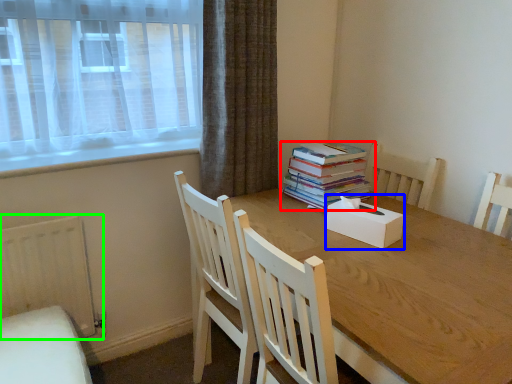
Question: Which object is positioned closest to book (highlighted by a red box)? Select from box (highlighted by a blue box) and radiator (highlighted by a green box).

Choices:
 (A) box
 (B) radiator

Answer: (A)